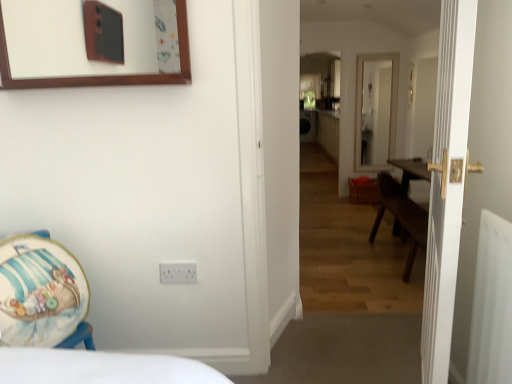
Identify the location of unoccupied region to the right of wooden floor at center. (383, 356).